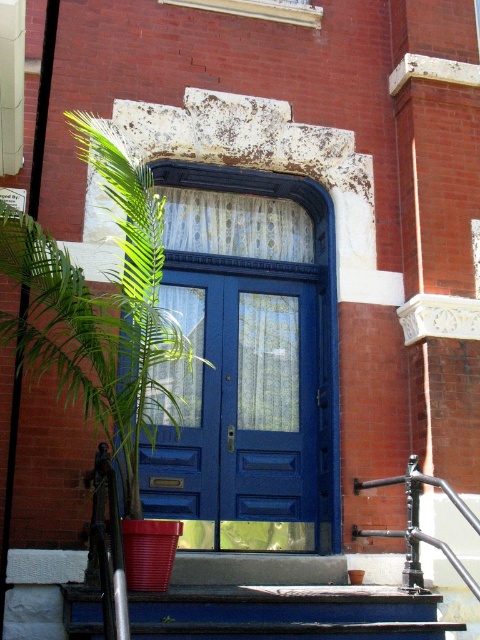
Is blue glossy door at center thinner than smooth blue stairs at center?

Indeed, blue glossy door at center has a lesser width compared to smooth blue stairs at center.

Is blue glossy door at center shorter than smooth blue stairs at center?

In fact, blue glossy door at center may be taller than smooth blue stairs at center.

This screenshot has height=640, width=480. I want to click on blue glossy door at center, so click(238, 416).

Where is `blue glossy door at center`? blue glossy door at center is located at coordinates (238, 416).

Is point (244, 480) in front of point (133, 273)?

No, (244, 480) is further to viewer.

Is blue glossy door at center behind green leafy plant at left?

Yes, blue glossy door at center is further from the viewer.

Locate an element on the screen. blue glossy door at center is located at coordinates (238, 416).

Does green leafy plant at left have a smaller size compared to smooth blue stairs at center?

Incorrect, green leafy plant at left is not smaller in size than smooth blue stairs at center.

Is green leafy plant at left thinner than smooth blue stairs at center?

Indeed, green leafy plant at left has a lesser width compared to smooth blue stairs at center.

Does point (0, 308) lie behind point (261, 632)?

Yes.

This screenshot has height=640, width=480. Find the location of `green leafy plant at left`. green leafy plant at left is located at coordinates (99, 308).